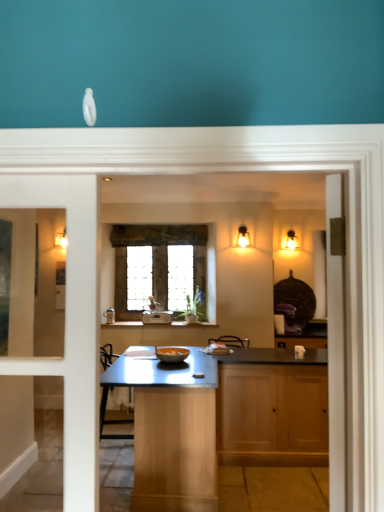
Question: Can you confirm if matte gold sconce at upper right, placed as the 2th light fixture when sorted from left to right, is shorter than stained glass window at center?

Choices:
 (A) no
 (B) yes

Answer: (B)

Question: Is matte gold sconce at upper right, positioned as the 1th light fixture in right-to-left order, turned away from stained glass window at center?

Choices:
 (A) no
 (B) yes

Answer: (A)

Question: From a real-world perspective, is matte gold sconce at upper right, placed as the 2th light fixture when sorted from left to right, physically below stained glass window at center?

Choices:
 (A) yes
 (B) no

Answer: (B)

Question: Is matte gold sconce at upper right, placed as the 2th light fixture when sorted from left to right, not near stained glass window at center?

Choices:
 (A) yes
 (B) no

Answer: (A)

Question: Is matte gold sconce at upper right, placed as the 2th light fixture when sorted from left to right, bigger than stained glass window at center?

Choices:
 (A) yes
 (B) no

Answer: (B)

Question: Looking at their shapes, would you say stained glass window at center is wider or thinner than matte gold sconce at upper right, positioned as the 1th light fixture in right-to-left order?

Choices:
 (A) thin
 (B) wide

Answer: (A)

Question: From their relative heights in the image, would you say stained glass window at center is taller or shorter than matte gold sconce at upper right, placed as the second light fixture when sorted from front to back?

Choices:
 (A) short
 (B) tall

Answer: (B)

Question: From a real-world perspective, relative to matte gold sconce at upper right, which is the first light fixture from back to front, is stained glass window at center vertically above or below?

Choices:
 (A) above
 (B) below

Answer: (B)

Question: Relative to matte gold sconce at upper right, placed as the 2th light fixture when sorted from left to right, is stained glass window at center in front or behind?

Choices:
 (A) behind
 (B) front

Answer: (B)

Question: Relative to teal matte wall at upper center, is matte gold sconce at upper right, placed as the 2th light fixture when sorted from left to right, in front or behind?

Choices:
 (A) front
 (B) behind

Answer: (B)

Question: Looking at their shapes, would you say matte gold sconce at upper right, placed as the second light fixture when sorted from front to back, is wider or thinner than teal matte wall at upper center?

Choices:
 (A) wide
 (B) thin

Answer: (B)

Question: Is matte gold sconce at upper right, placed as the 2th light fixture when sorted from left to right, bigger or smaller than teal matte wall at upper center?

Choices:
 (A) small
 (B) big

Answer: (A)

Question: From a real-world perspective, relative to teal matte wall at upper center, is matte gold sconce at upper right, placed as the 2th light fixture when sorted from left to right, vertically above or below?

Choices:
 (A) above
 (B) below

Answer: (B)

Question: Considering their positions, is matte gold sconce at upper right, placed as the second light fixture when sorted from front to back, located in front of or behind matte glass sconce at upper center, the second light fixture viewed from the right?

Choices:
 (A) behind
 (B) front

Answer: (A)

Question: Considering the positions of matte gold sconce at upper right, placed as the 2th light fixture when sorted from left to right, and matte glass sconce at upper center, the second light fixture viewed from the right, in the image, is matte gold sconce at upper right, placed as the 2th light fixture when sorted from left to right, bigger or smaller than matte glass sconce at upper center, the second light fixture viewed from the right,?

Choices:
 (A) big
 (B) small

Answer: (A)